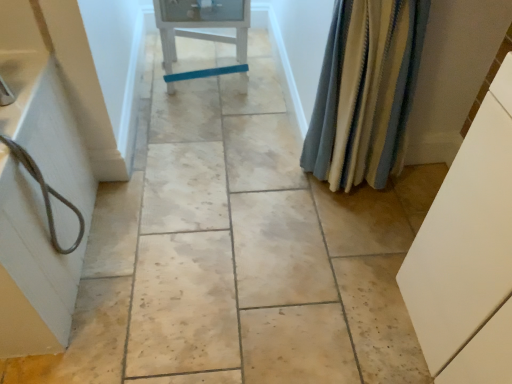
Question: Can striped fabric shower curtain at right be found inside white painted wood chair at center?

Choices:
 (A) no
 (B) yes

Answer: (A)

Question: Is white painted wood chair at center located outside striped fabric shower curtain at right?

Choices:
 (A) no
 (B) yes

Answer: (B)

Question: Does white painted wood chair at center lie in front of striped fabric shower curtain at right?

Choices:
 (A) yes
 (B) no

Answer: (B)

Question: Considering the relative sizes of white painted wood chair at center and striped fabric shower curtain at right in the image provided, is white painted wood chair at center shorter than striped fabric shower curtain at right?

Choices:
 (A) no
 (B) yes

Answer: (B)

Question: Is white painted wood chair at center to the right of striped fabric shower curtain at right from the viewer's perspective?

Choices:
 (A) no
 (B) yes

Answer: (A)

Question: Relative to white painted wood chair at center, is striped fabric shower curtain at right in front or behind?

Choices:
 (A) front
 (B) behind

Answer: (A)

Question: From the image's perspective, relative to white painted wood chair at center, is striped fabric shower curtain at right above or below?

Choices:
 (A) above
 (B) below

Answer: (B)

Question: From a real-world perspective, is striped fabric shower curtain at right positioned above or below white painted wood chair at center?

Choices:
 (A) above
 (B) below

Answer: (A)

Question: Is striped fabric shower curtain at right wider or thinner than white painted wood chair at center?

Choices:
 (A) wide
 (B) thin

Answer: (B)

Question: From a real-world perspective, is matte gray cord at left above or below white matte cabinet at right?

Choices:
 (A) below
 (B) above

Answer: (B)

Question: In the image, is matte gray cord at left positioned in front of or behind white matte cabinet at right?

Choices:
 (A) behind
 (B) front

Answer: (A)

Question: Based on their positions, is matte gray cord at left located to the left or right of white matte cabinet at right?

Choices:
 (A) left
 (B) right

Answer: (A)

Question: In terms of height, does matte gray cord at left look taller or shorter compared to white matte cabinet at right?

Choices:
 (A) tall
 (B) short

Answer: (B)

Question: From the image's perspective, is striped fabric shower curtain at right located above or below white matte cabinet at right?

Choices:
 (A) above
 (B) below

Answer: (A)

Question: In terms of width, does striped fabric shower curtain at right look wider or thinner when compared to white matte cabinet at right?

Choices:
 (A) wide
 (B) thin

Answer: (B)